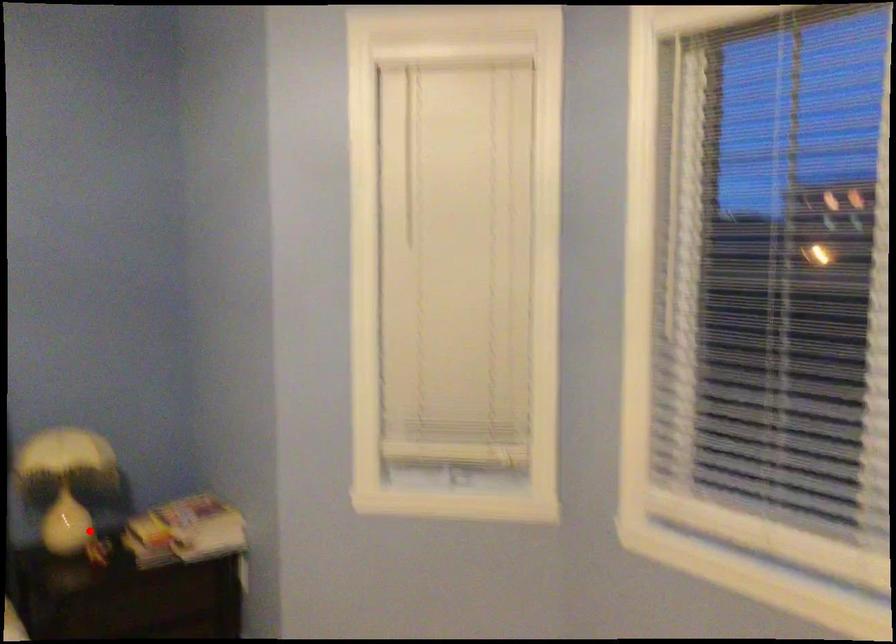
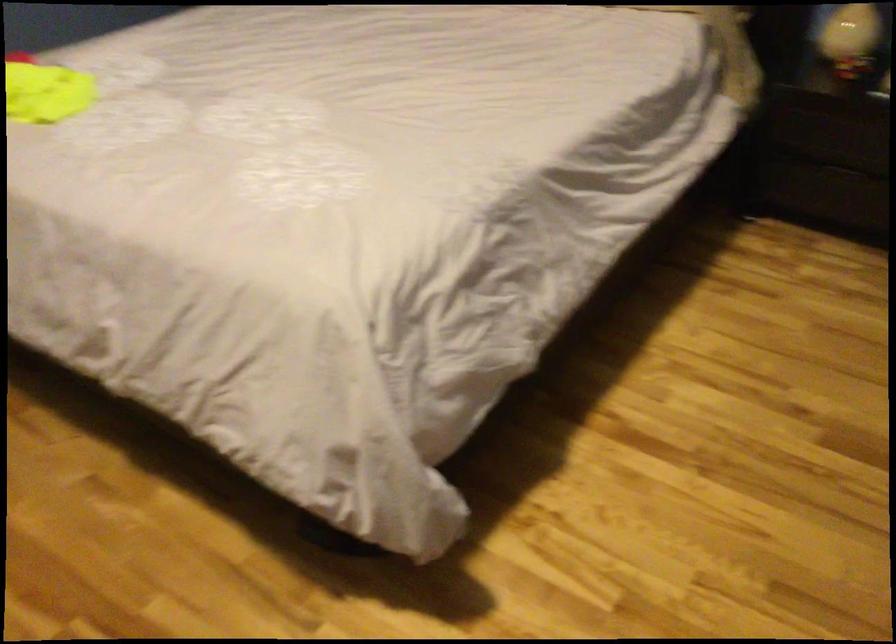
Where in the second image is the point corresponding to the highlighted location from the first image?

(851, 39)